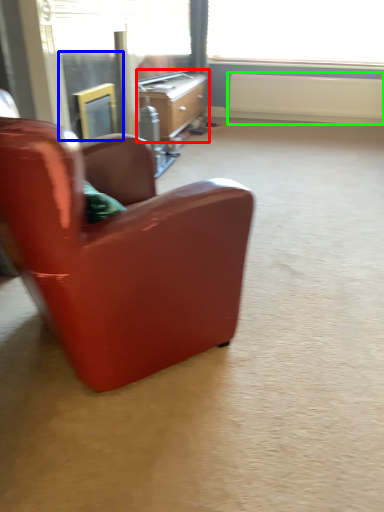
Question: Estimate the real-world distances between objects in this image. Which object is farther from desk (highlighted by a red box), screen door (highlighted by a blue box) or radiator (highlighted by a green box)?

Choices:
 (A) screen door
 (B) radiator

Answer: (B)